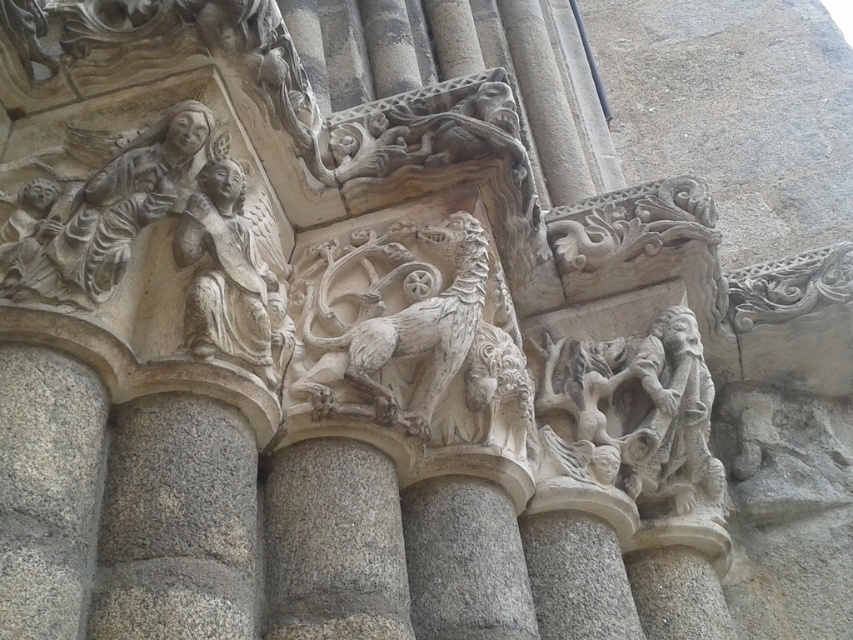
Question: Which object appears closest to the camera in this image?

Choices:
 (A) gray stone pillar at center
 (B) white stone lion at center
 (C) carved stone figure at center
 (D) white stone angel at upper left

Answer: (A)

Question: Can you confirm if gray stone relief at upper left is bigger than white stone lion at center?

Choices:
 (A) no
 (B) yes

Answer: (A)

Question: Can you confirm if carved stone figure at center is positioned above gray stone relief at upper left?

Choices:
 (A) yes
 (B) no

Answer: (B)

Question: Which point is closer to the camera taking this photo?

Choices:
 (A) (682, 460)
 (B) (106, 291)
 (C) (235, 221)
 (D) (399, 333)

Answer: (B)

Question: Among these objects, which one is nearest to the camera?

Choices:
 (A) white stone angel at upper left
 (B) gray stone relief at upper left
 (C) white stone lion at center

Answer: (B)

Question: Can you confirm if carved stone figure at center is positioned to the right of white stone angel at upper left?

Choices:
 (A) yes
 (B) no

Answer: (A)